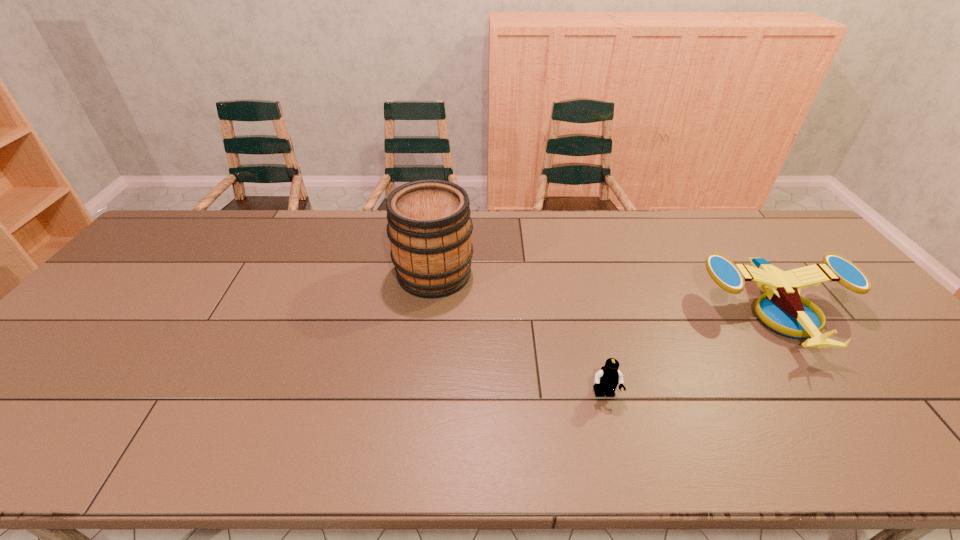
At what (x,y) coordinates should I click in order to perform the action: click on free space that is in between the nearest object and the drone. Please return your answer as a coordinate pair (x, y). The image size is (960, 540). Looking at the image, I should click on (691, 354).

You are a GUI agent. You are given a task and a screenshot of the screen. Output one action in this format:
    pyautogui.click(x=<x>, y=<y>)
    Task: Click on the free space that is in between the cider and the drone
    
    Given the screenshot: What is the action you would take?
    pyautogui.click(x=606, y=293)

In order to click on vacant area that lies between the Lego and the rightmost object in this screenshot , I will do `click(691, 354)`.

The image size is (960, 540). Find the location of `vacant space that is in between the drone and the cider`. vacant space that is in between the drone and the cider is located at coordinates (606, 293).

Locate an element on the screen. object that stands as the closest to the tallest object is located at coordinates (608, 377).

Locate an element on the screen. This screenshot has width=960, height=540. object that can be found as the second closest to the second object from right to left is located at coordinates (429, 226).